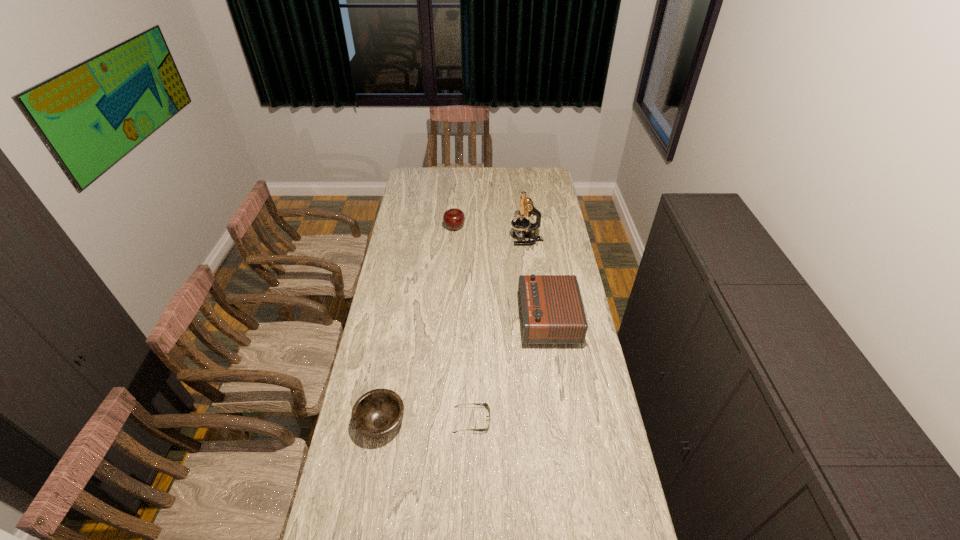
Identify the location of vacant region at the left edge of the desktop. The image size is (960, 540). (397, 354).

Image resolution: width=960 pixels, height=540 pixels. In the image, there is a desktop. What are the coordinates of `vacant space at the right edge` in the screenshot? It's located at (630, 536).

Where is `free space between the shortest object and the tallest object`? free space between the shortest object and the tallest object is located at coordinates pos(499,330).

This screenshot has width=960, height=540. In order to click on vacant point located between the bowl and the fourth shortest object in this screenshot , I will do `click(465, 372)`.

This screenshot has height=540, width=960. I want to click on free spot between the tallest object and the third tallest object, so click(x=491, y=234).

Find the location of a particular element. vacant space that is in between the shortest object and the third tallest object is located at coordinates (463, 324).

Identify the location of free spot between the third tallest object and the shortest object. (463, 324).

Find the location of a particular element. The image size is (960, 540). vacant area between the sunglasses and the microscope is located at coordinates (499, 330).

You are a GUI agent. You are given a task and a screenshot of the screen. Output one action in this format:
    pyautogui.click(x=<x>, y=<y>)
    Task: Click on the vacant point located between the third shortest object and the third farthest object
    
    Given the screenshot: What is the action you would take?
    pyautogui.click(x=501, y=274)

Image resolution: width=960 pixels, height=540 pixels. What are the coordinates of `empty space that is in between the third shortest object and the fourth tallest object` in the screenshot? It's located at (418, 326).